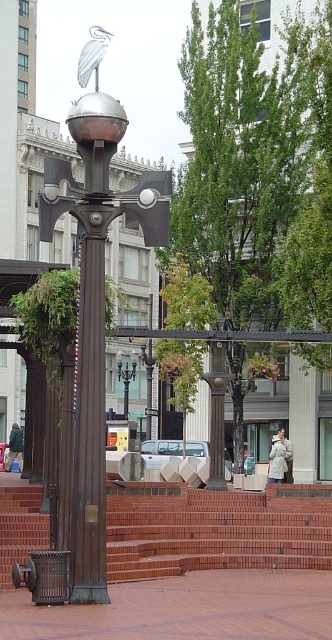
Question: Does brick stairs at center have a smaller size compared to polished bronze streetlight at center?

Choices:
 (A) yes
 (B) no

Answer: (B)

Question: Which object appears farthest from the camera in this image?

Choices:
 (A) bronze textured column at center
 (B) brick stairs at center

Answer: (A)

Question: Is brick stairs at center thinner than bronze textured column at center?

Choices:
 (A) no
 (B) yes

Answer: (A)

Question: Is brick stairs at center below polished bronze streetlight at center?

Choices:
 (A) no
 (B) yes

Answer: (B)

Question: Estimate the real-world distances between objects in this image. Which object is closer to the brick stairs at center?

Choices:
 (A) bronze textured column at center
 (B) polished bronze streetlight at center

Answer: (A)

Question: Among these points, which one is farthest from the camera?

Choices:
 (A) (228, 545)
 (B) (210, 396)

Answer: (B)